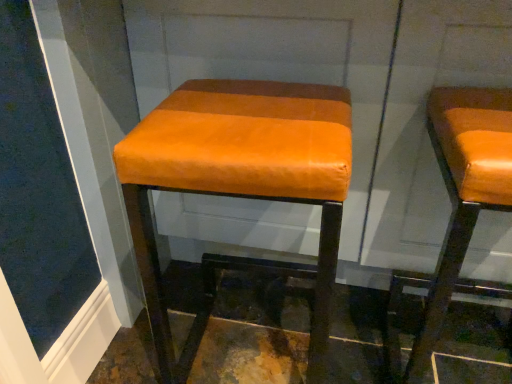
Question: Is orange leather stool at center, marked as the second stool in a right-to-left arrangement, spatially inside orange leather stool at right, placed as the 2th stool when sorted from left to right, or outside of it?

Choices:
 (A) outside
 (B) inside

Answer: (A)

Question: From the image's perspective, is orange leather stool at center, marked as the second stool in a right-to-left arrangement, located above or below orange leather stool at right, placed as the 2th stool when sorted from left to right?

Choices:
 (A) below
 (B) above

Answer: (B)

Question: Relative to orange leather stool at right, the 1th stool positioned from the right, is orange leather stool at center, marked as the second stool in a right-to-left arrangement, in front or behind?

Choices:
 (A) behind
 (B) front

Answer: (A)

Question: Is orange leather stool at right, the 1th stool positioned from the right, situated inside orange leather stool at center, placed as the 1th stool when sorted from left to right, or outside?

Choices:
 (A) outside
 (B) inside

Answer: (A)

Question: In terms of size, does orange leather stool at right, the 1th stool positioned from the right, appear bigger or smaller than orange leather stool at center, placed as the 1th stool when sorted from left to right?

Choices:
 (A) big
 (B) small

Answer: (B)

Question: From the image's perspective, is orange leather stool at right, placed as the 2th stool when sorted from left to right, positioned above or below orange leather stool at center, placed as the 1th stool when sorted from left to right?

Choices:
 (A) above
 (B) below

Answer: (B)

Question: Considering the positions of orange leather stool at right, the 1th stool positioned from the right, and orange leather stool at center, marked as the second stool in a right-to-left arrangement, in the image, is orange leather stool at right, the 1th stool positioned from the right, taller or shorter than orange leather stool at center, marked as the second stool in a right-to-left arrangement,?

Choices:
 (A) short
 (B) tall

Answer: (A)